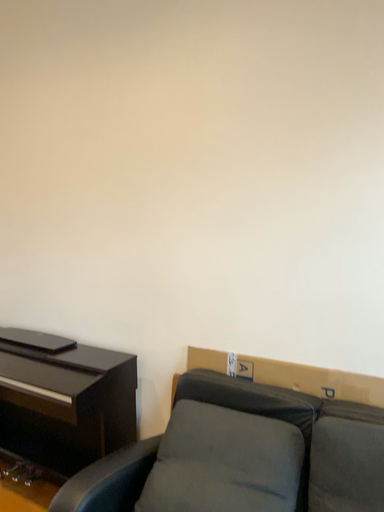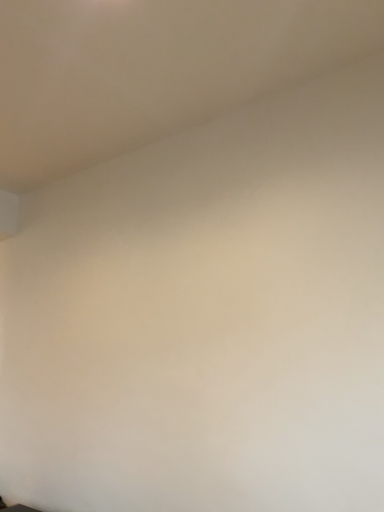
Question: How did the camera likely rotate when shooting the video?

Choices:
 (A) rotated downward
 (B) rotated upward

Answer: (B)